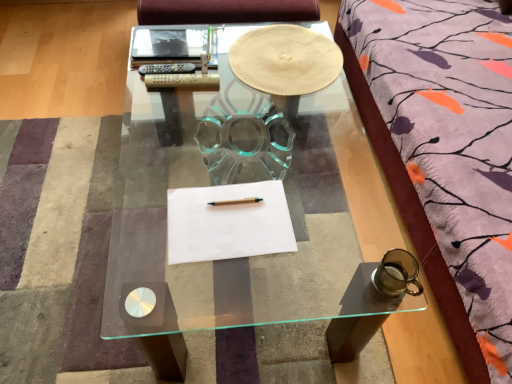
Question: Which is correct: white paper at upper center, the 2th notebook when ordered from front to back, is inside transparent glass coffee table at center, or outside of it?

Choices:
 (A) inside
 (B) outside

Answer: (B)

Question: From a real-world perspective, relative to transparent glass coffee table at center, is white paper at upper center, the 2th notebook when ordered from front to back, vertically above or below?

Choices:
 (A) above
 (B) below

Answer: (A)

Question: Which object is positioned farthest from the white paper at upper center, acting as the 2th notebook starting from the bottom?

Choices:
 (A) matte cardboard plate at center
 (B) white paper at center, which appears as the 1th notebook when viewed from the front
 (C) wooden pencil at center
 (D) transparent glass coffee table at center

Answer: (C)

Question: Estimate the real-world distances between objects in this image. Which object is closer to the transparent glass coffee table at center?

Choices:
 (A) white paper at center, which appears as the 1th notebook when viewed from the front
 (B) wooden pencil at center
 (C) matte cardboard plate at center
 (D) white paper at upper center, acting as the 2th notebook starting from the bottom

Answer: (A)